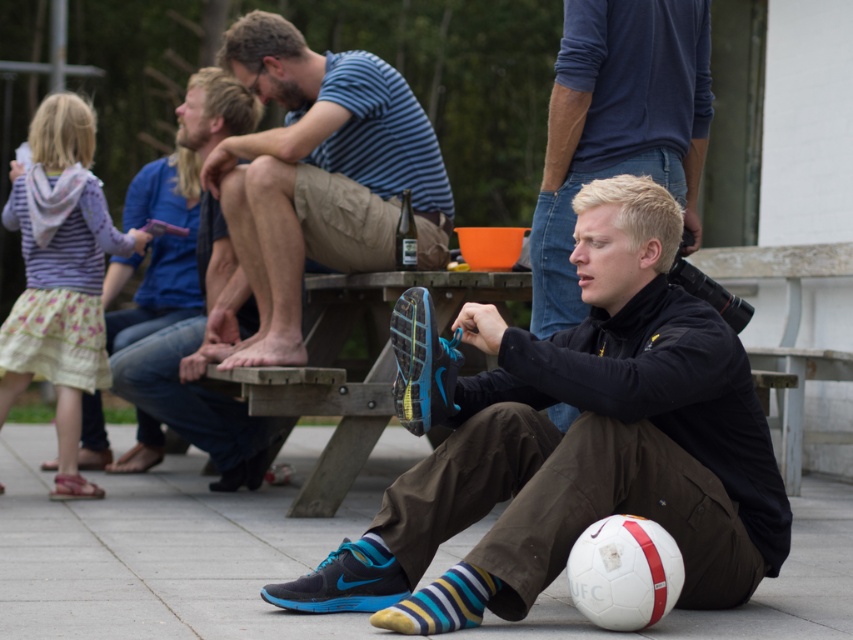
You are a photographer setting up a tripod to take a group photo of the matte black jacket at center and the striped cotton shirt at upper center. Based on their positions, which object should you position closer to the camera to ensure both are in focus?

The matte black jacket at center should be positioned closer to the camera since it has a lesser height compared to the striped cotton shirt at upper center, ensuring both are in focus.

You are a photographer at the park and want to capture both the striped cotton shirt at upper center and the black matte jacket at center in a single frame. Which clothing item will appear bigger in the photo?

The striped cotton shirt at upper center will appear bigger in the photo because it has a larger size compared to the black matte jacket at center.

You are a photographer taking a picture of the scene. You want to focus on the matte black jacket at center and the striped cotton shirt at upper center. Which object should you adjust your camera to focus on first if you want to capture both in the same frame?

The matte black jacket at center is located below the striped cotton shirt at upper center, so you should focus on the striped cotton shirt at upper center first to ensure both are in the same frame.